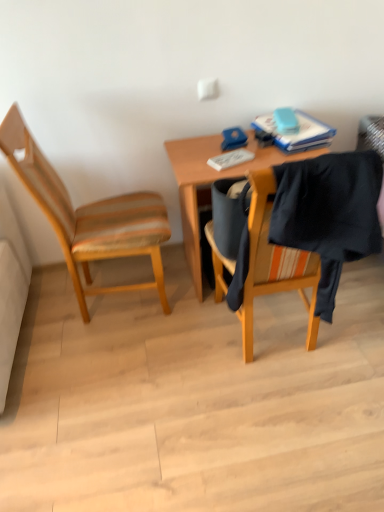
Question: Is black fabric at right completely or partially outside of wooden chair at left?

Choices:
 (A) no
 (B) yes

Answer: (B)

Question: Considering the relative sizes of black fabric at right and wooden chair at left in the image provided, is black fabric at right bigger than wooden chair at left?

Choices:
 (A) yes
 (B) no

Answer: (B)

Question: From a real-world perspective, is black fabric at right under wooden chair at left?

Choices:
 (A) yes
 (B) no

Answer: (B)

Question: Is black fabric at right facing away from wooden chair at left?

Choices:
 (A) yes
 (B) no

Answer: (B)

Question: Can you confirm if black fabric at right is wider than wooden chair at left?

Choices:
 (A) no
 (B) yes

Answer: (A)

Question: Is black fabric at right in front of wooden chair at left?

Choices:
 (A) yes
 (B) no

Answer: (A)

Question: Does wooden desk at center appear on the right side of blue matte book at upper right?

Choices:
 (A) no
 (B) yes

Answer: (A)

Question: Is wooden desk at center positioned beyond the bounds of blue matte book at upper right?

Choices:
 (A) yes
 (B) no

Answer: (A)

Question: Does wooden desk at center have a lesser width compared to blue matte book at upper right?

Choices:
 (A) no
 (B) yes

Answer: (A)

Question: From a real-world perspective, is wooden desk at center beneath blue matte book at upper right?

Choices:
 (A) no
 (B) yes

Answer: (B)

Question: Considering the relative sizes of wooden desk at center and blue matte book at upper right in the image provided, is wooden desk at center smaller than blue matte book at upper right?

Choices:
 (A) no
 (B) yes

Answer: (A)

Question: Considering the relative sizes of wooden desk at center and blue matte book at upper right in the image provided, is wooden desk at center bigger than blue matte book at upper right?

Choices:
 (A) yes
 (B) no

Answer: (A)

Question: From a real-world perspective, is blue matte book at upper right located beneath wooden desk at center?

Choices:
 (A) yes
 (B) no

Answer: (B)